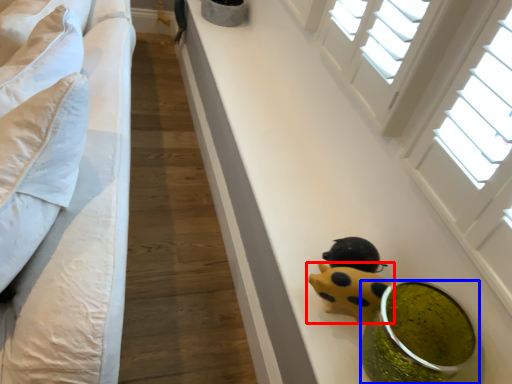
Question: Which object is further to the camera taking this photo, toy (highlighted by a red box) or food (highlighted by a blue box)?

Choices:
 (A) toy
 (B) food

Answer: (A)